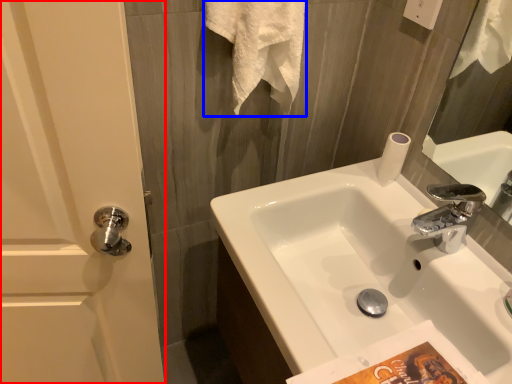
Question: Among these objects, which one is nearest to the camera, screen door (highlighted by a red box) or bath towel (highlighted by a blue box)?

Choices:
 (A) screen door
 (B) bath towel

Answer: (A)